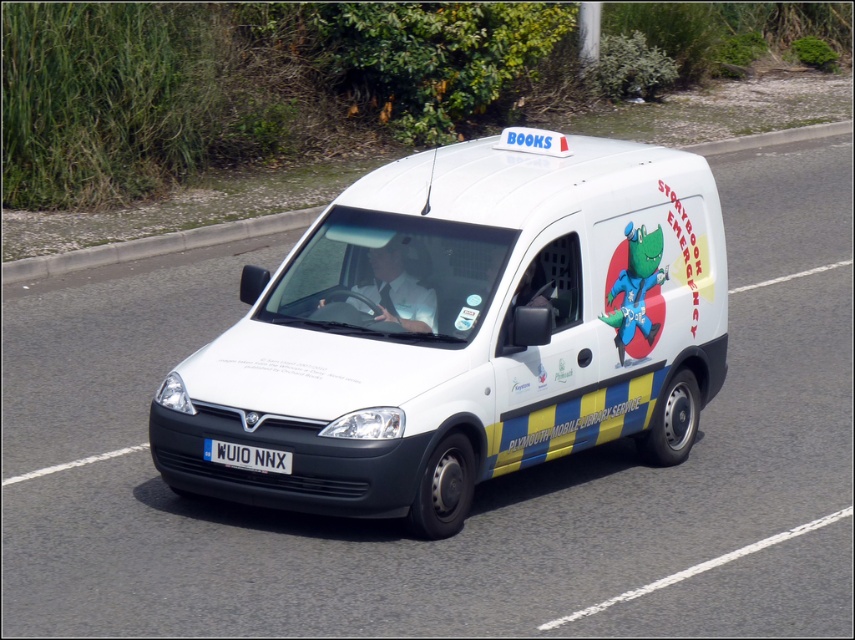
Is the position of white matte van at center more distant than that of white plastic license plate at center?

No, it is not.

Between white matte van at center and white plastic license plate at center, which one has less height?

white plastic license plate at center

The width and height of the screenshot is (855, 640). Describe the element at coordinates (464, 330) in the screenshot. I see `white matte van at center` at that location.

Where is `white matte van at center`? The image size is (855, 640). white matte van at center is located at coordinates (464, 330).